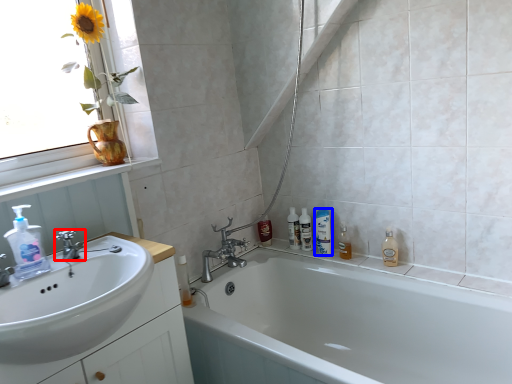
Question: Which of the following is the closest to the observer, tap (highlighted by a red box) or mouthwash (highlighted by a blue box)?

Choices:
 (A) tap
 (B) mouthwash

Answer: (A)